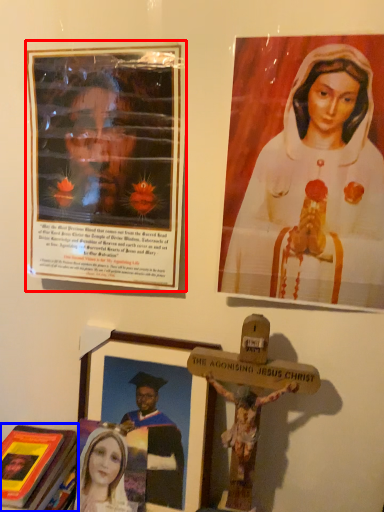
Question: Which point is further to the camera, picture frame (highlighted by a red box) or book (highlighted by a blue box)?

Choices:
 (A) picture frame
 (B) book

Answer: (B)